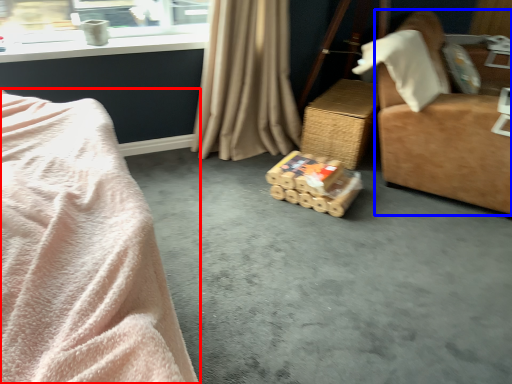
Question: Which object appears farthest to the camera in this image, bed (highlighted by a red box) or furniture (highlighted by a blue box)?

Choices:
 (A) bed
 (B) furniture

Answer: (B)